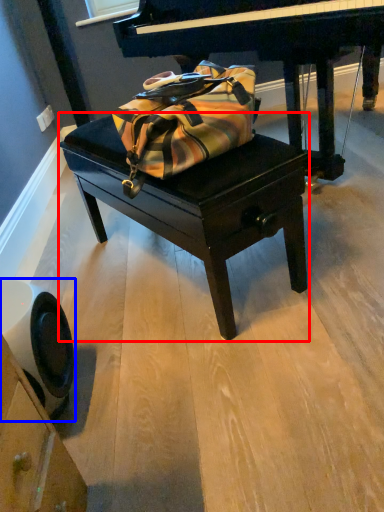
Question: Among these objects, which one is farthest to the camera, table (highlighted by a red box) or swivel chair (highlighted by a blue box)?

Choices:
 (A) table
 (B) swivel chair

Answer: (A)